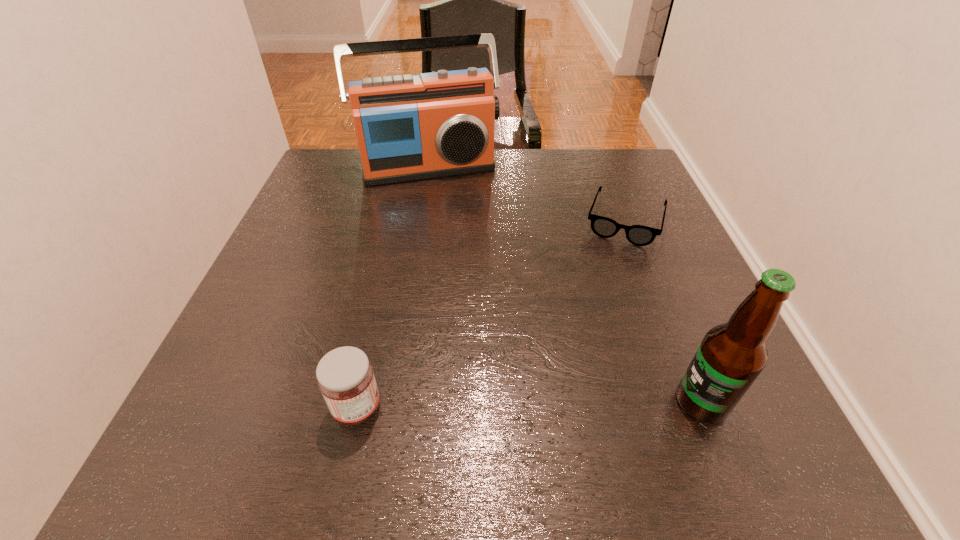
Locate an element on the screen. free space on the desktop that is between the second shortest object and the third shortest object and is positioned on the front-facing side of the farthest object is located at coordinates (500, 406).

Where is `free space on the desktop that is between the second shortest object and the beer bottle and is positioned on the arms of the second farthest object`? This screenshot has width=960, height=540. free space on the desktop that is between the second shortest object and the beer bottle and is positioned on the arms of the second farthest object is located at coordinates (573, 404).